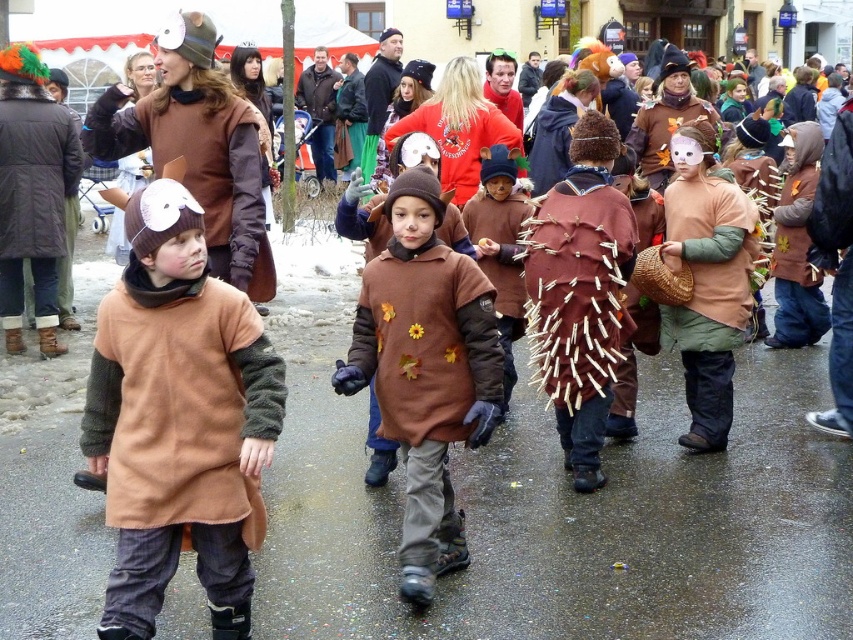
In the scene shown: Is brown felt dress at center positioned at the back of matte brown costume at center?

No, brown felt dress at center is in front of matte brown costume at center.

This screenshot has width=853, height=640. In order to click on brown felt dress at center in this screenshot , I will do `click(425, 369)`.

From the picture: Measure the distance between brown felt dress at center and camera.

brown felt dress at center is 4.36 meters away from camera.

Locate an element on the screen. The image size is (853, 640). brown felt dress at center is located at coordinates (425, 369).

Does matte brown costume at center lie behind brown felt costume at center?

No, matte brown costume at center is closer to the viewer.

Describe the element at coordinates (706, 280) in the screenshot. I see `matte brown costume at center` at that location.

The image size is (853, 640). I want to click on matte brown costume at center, so click(706, 280).

Who is more forward, (223, 346) or (518, 292)?

Point (223, 346) is more forward.

Can you confirm if matte brown dress at center is positioned to the right of brown felt costume at center?

In fact, matte brown dress at center is to the left of brown felt costume at center.

Image resolution: width=853 pixels, height=640 pixels. What do you see at coordinates (178, 420) in the screenshot?
I see `matte brown dress at center` at bounding box center [178, 420].

I want to click on matte brown dress at center, so click(178, 420).